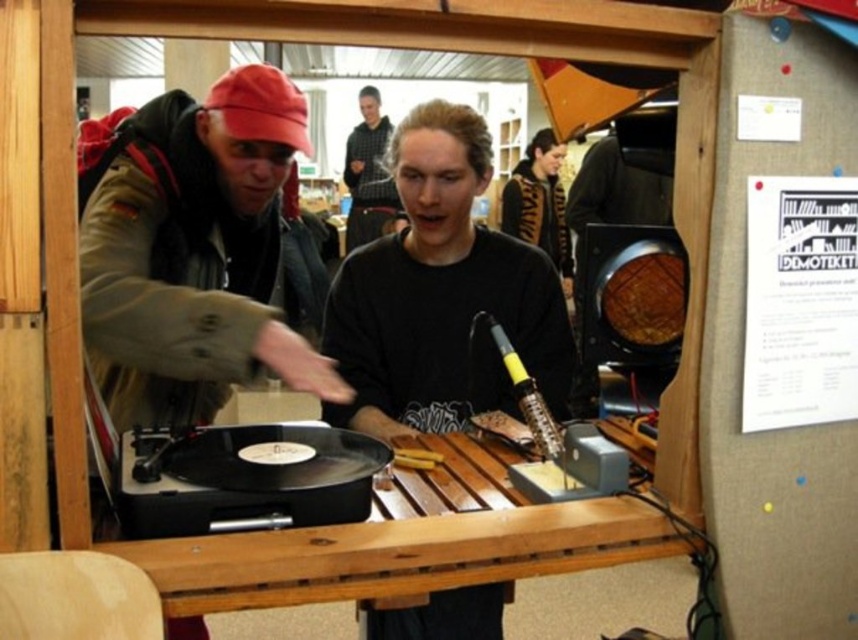
What do you see at coordinates (442, 296) in the screenshot?
I see `black matte shirt at center` at bounding box center [442, 296].

Who is more forward, (391, 236) or (289, 540)?

Point (289, 540) is more forward.

The image size is (858, 640). What are the coordinates of `black matte shirt at center` in the screenshot? It's located at (442, 296).

Who is positioned more to the right, wooden table at center or dark gray hoodie at center?

From the viewer's perspective, wooden table at center appears more on the right side.

Does wooden table at center have a lesser width compared to dark gray hoodie at center?

No.

Does point (325, 564) come behind point (385, 134)?

No, it is not.

This screenshot has height=640, width=858. In order to click on wooden table at center in this screenshot , I will do `click(408, 547)`.

Is wooden table at center taller than black textured sweater at upper center?

No, wooden table at center is not taller than black textured sweater at upper center.

Does wooden table at center appear on the right side of black textured sweater at upper center?

Incorrect, wooden table at center is not on the right side of black textured sweater at upper center.

Between point (190, 540) and point (556, 220), which one is positioned behind?

The point (556, 220) is more distant.

Locate an element on the screen. wooden table at center is located at coordinates (408, 547).